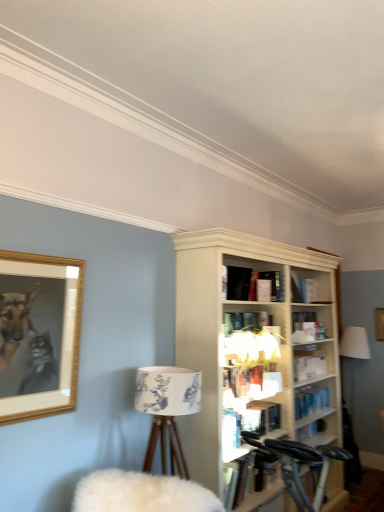
Question: Does hardcover book at center, the 1th book ordered from the bottom, come in front of metallic silver bicycle at lower right?

Choices:
 (A) no
 (B) yes

Answer: (A)

Question: Is hardcover book at center, the 1th book ordered from the bottom, not within metallic silver bicycle at lower right?

Choices:
 (A) no
 (B) yes

Answer: (B)

Question: Does hardcover book at center, arranged as the 2th book when viewed from the top, have a larger size compared to metallic silver bicycle at lower right?

Choices:
 (A) no
 (B) yes

Answer: (A)

Question: From the image's perspective, does hardcover book at center, arranged as the 2th book when viewed from the top, appear lower than metallic silver bicycle at lower right?

Choices:
 (A) yes
 (B) no

Answer: (B)

Question: Is hardcover book at center, arranged as the 2th book when viewed from the top, at the right side of metallic silver bicycle at lower right?

Choices:
 (A) yes
 (B) no

Answer: (B)

Question: Considering the positions of point (24, 412) and point (145, 483), is point (24, 412) closer or farther from the camera than point (145, 483)?

Choices:
 (A) farther
 (B) closer

Answer: (A)

Question: Looking at the image, does wooden picture frame at upper left seem bigger or smaller compared to white fluffy swivel chair at lower left?

Choices:
 (A) small
 (B) big

Answer: (A)

Question: Considering the positions of wooden picture frame at upper left and white fluffy swivel chair at lower left in the image, is wooden picture frame at upper left taller or shorter than white fluffy swivel chair at lower left?

Choices:
 (A) short
 (B) tall

Answer: (B)

Question: From a real-world perspective, is wooden picture frame at upper left physically located above or below white fluffy swivel chair at lower left?

Choices:
 (A) above
 (B) below

Answer: (A)

Question: From their relative heights in the image, would you say matte black book at upper center, which is the 1th book in top-to-bottom order, is taller or shorter than white fluffy swivel chair at lower left?

Choices:
 (A) tall
 (B) short

Answer: (B)

Question: Is matte black book at upper center, the 2th book from the bottom, in front of or behind white fluffy swivel chair at lower left in the image?

Choices:
 (A) front
 (B) behind

Answer: (B)

Question: Would you say matte black book at upper center, which is the 1th book in top-to-bottom order, is inside or outside white fluffy swivel chair at lower left?

Choices:
 (A) inside
 (B) outside

Answer: (B)

Question: Is point (240, 282) positioned closer to the camera than point (119, 495)?

Choices:
 (A) farther
 (B) closer

Answer: (A)

Question: Relative to white fabric lampshade at upper center, is matte black book at upper center, which is the 1th book in top-to-bottom order, in front or behind?

Choices:
 (A) behind
 (B) front

Answer: (A)

Question: Looking at the image, does matte black book at upper center, which is the 1th book in top-to-bottom order, seem bigger or smaller compared to white fabric lampshade at upper center?

Choices:
 (A) small
 (B) big

Answer: (A)